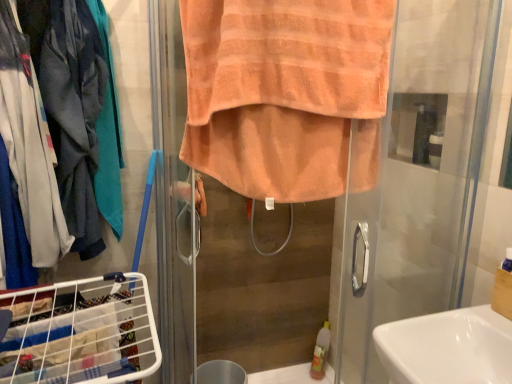
Question: Is metallic silver trash bin/can at lower center oriented towards white glossy sink at lower right?

Choices:
 (A) no
 (B) yes

Answer: (A)

Question: Is white glossy sink at lower right located within metallic silver trash bin/can at lower center?

Choices:
 (A) no
 (B) yes

Answer: (A)

Question: Does metallic silver trash bin/can at lower center lie in front of white glossy sink at lower right?

Choices:
 (A) yes
 (B) no

Answer: (B)

Question: Can you confirm if metallic silver trash bin/can at lower center is thinner than white glossy sink at lower right?

Choices:
 (A) no
 (B) yes

Answer: (B)

Question: Does metallic silver trash bin/can at lower center touch white glossy sink at lower right?

Choices:
 (A) yes
 (B) no

Answer: (B)

Question: Is metallic silver trash bin/can at lower center bigger than white glossy sink at lower right?

Choices:
 (A) yes
 (B) no

Answer: (B)

Question: Is matte gray jacket at left not near white glossy sink at lower right?

Choices:
 (A) yes
 (B) no

Answer: (A)

Question: Could white glossy sink at lower right be considered to be inside matte gray jacket at left?

Choices:
 (A) no
 (B) yes

Answer: (A)

Question: From the image's perspective, is matte gray jacket at left on top of white glossy sink at lower right?

Choices:
 (A) yes
 (B) no

Answer: (A)

Question: Is matte gray jacket at left positioned in front of white glossy sink at lower right?

Choices:
 (A) yes
 (B) no

Answer: (B)

Question: From a real-world perspective, is matte gray jacket at left positioned over white glossy sink at lower right based on gravity?

Choices:
 (A) no
 (B) yes

Answer: (B)

Question: Is matte gray jacket at left located outside white glossy sink at lower right?

Choices:
 (A) no
 (B) yes

Answer: (B)

Question: Is orange terry towel at center oriented away from white wire laundry basket at lower left?

Choices:
 (A) yes
 (B) no

Answer: (B)